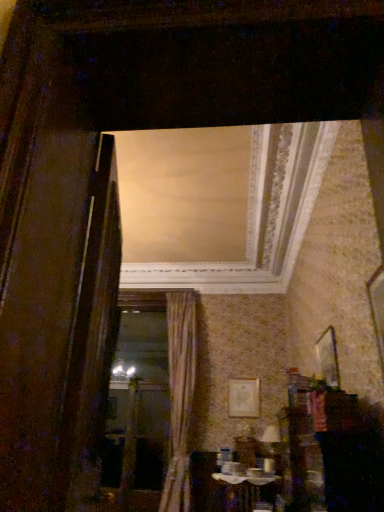
Question: Looking at the image, does gold textured curtain at center seem bigger or smaller compared to wooden frame at center?

Choices:
 (A) small
 (B) big

Answer: (B)

Question: Considering the positions of point (172, 452) and point (163, 371), is point (172, 452) closer or farther from the camera than point (163, 371)?

Choices:
 (A) closer
 (B) farther

Answer: (A)

Question: Which object is the farthest from the matte gold picture frame at center, which is the 2th picture frame in top-to-bottom order?

Choices:
 (A) wooden picture frame at upper right, the first picture frame when ordered from front to back
 (B) wooden table at lower center
 (C) wooden frame at center
 (D) gold textured curtain at center

Answer: (C)

Question: Estimate the real-world distances between objects in this image. Which object is closer to the wooden picture frame at upper right, marked as the 1th picture frame in a right-to-left arrangement?

Choices:
 (A) wooden frame at center
 (B) gold textured curtain at center
 (C) matte gold picture frame at center, which ranks as the first picture frame in bottom-to-top order
 (D) wooden table at lower center

Answer: (C)